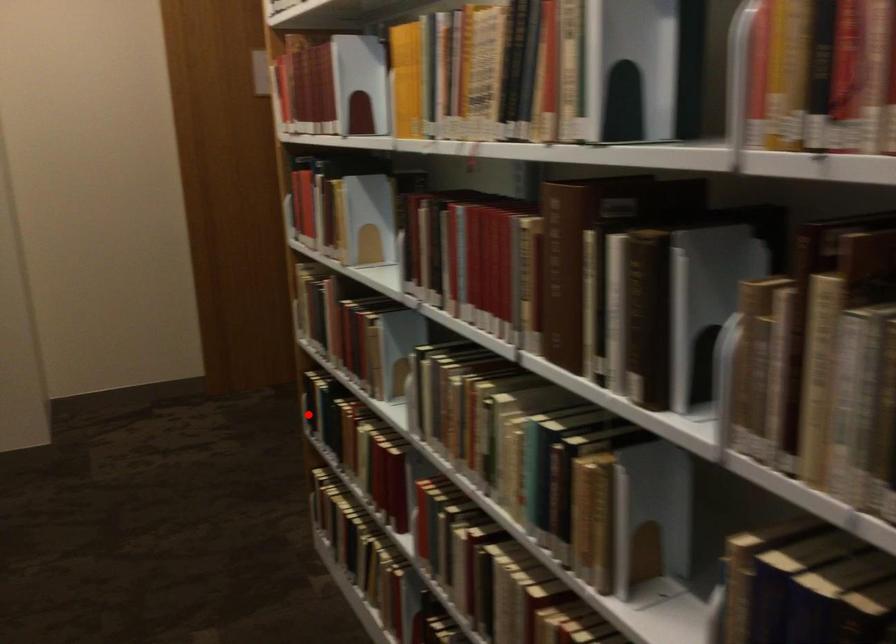
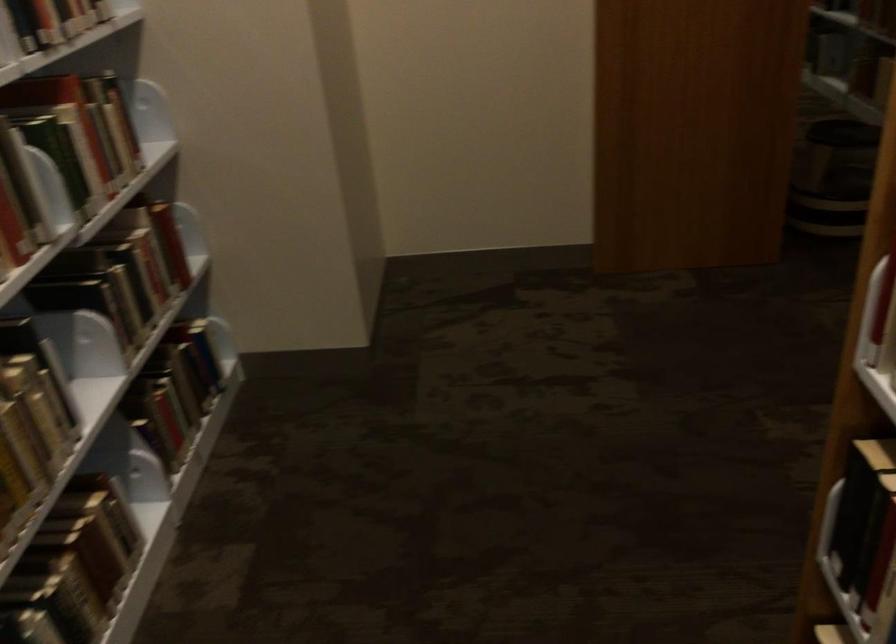
In the second image, find the point that corresponds to the highlighted location in the first image.

(860, 545)